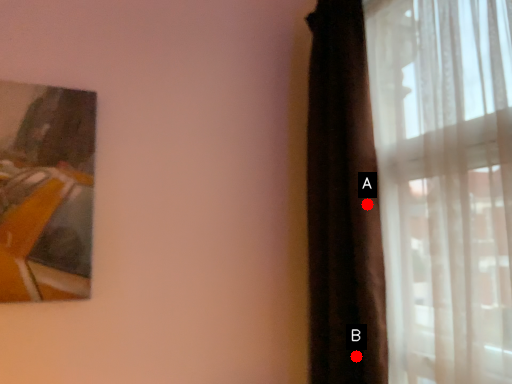
Question: Two points are circled on the image, labeled by A and B beside each circle. Which of the following is the closest to the observer?

Choices:
 (A) A is closer
 (B) B is closer

Answer: (B)